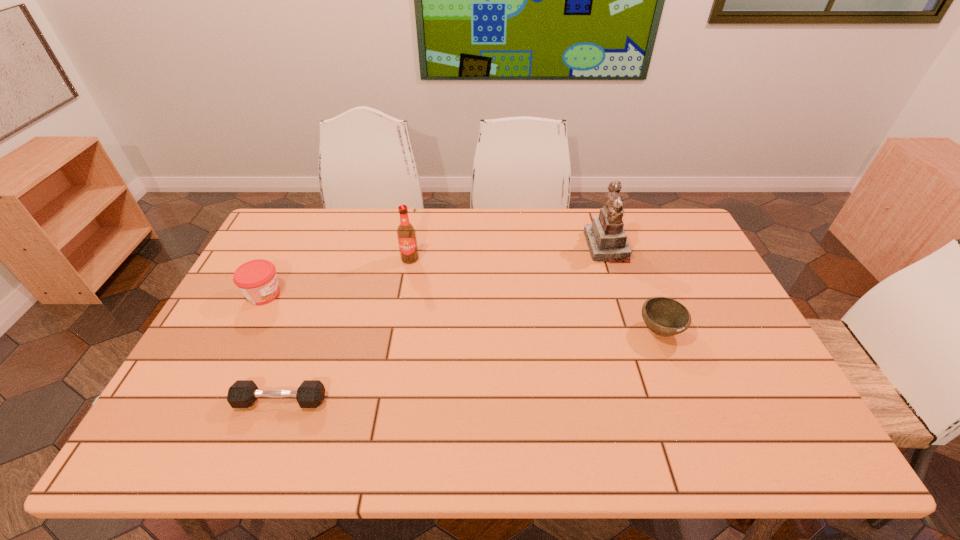
Find the location of a particular element. vacant space located on the front-facing side of the figurine is located at coordinates (481, 246).

Locate an element on the screen. The height and width of the screenshot is (540, 960). vacant space located on the front-facing side of the figurine is located at coordinates click(498, 246).

This screenshot has width=960, height=540. Find the location of `vacant space located 0.080m on the left of the beer bottle`. vacant space located 0.080m on the left of the beer bottle is located at coordinates (376, 259).

The image size is (960, 540). I want to click on free point located 0.090m on the label side of the third farthest object, so click(313, 294).

You are a GUI agent. You are given a task and a screenshot of the screen. Output one action in this format:
    pyautogui.click(x=<x>, y=<y>)
    Task: Click on the free space located 0.350m on the back of the fourth farthest object
    This screenshot has height=540, width=960.
    Given the screenshot: What is the action you would take?
    (624, 239)

Locate an element on the screen. This screenshot has height=540, width=960. vacant position located 0.340m on the right of the fourth object from right to left is located at coordinates click(x=467, y=401).

Image resolution: width=960 pixels, height=540 pixels. In order to click on object present at the far edge in this screenshot , I will do `click(607, 241)`.

The image size is (960, 540). I want to click on jam that is at the left edge, so click(257, 280).

Identify the location of dumbbell located in the left edge section of the desktop. Image resolution: width=960 pixels, height=540 pixels. (243, 393).

I want to click on vacant position at the far edge of the desktop, so 475,245.